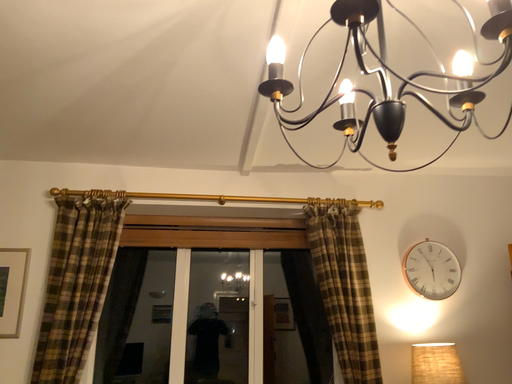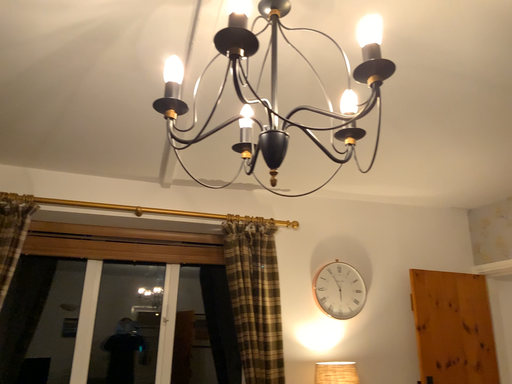
Question: How did the camera likely rotate when shooting the video?

Choices:
 (A) rotated left
 (B) rotated right

Answer: (B)